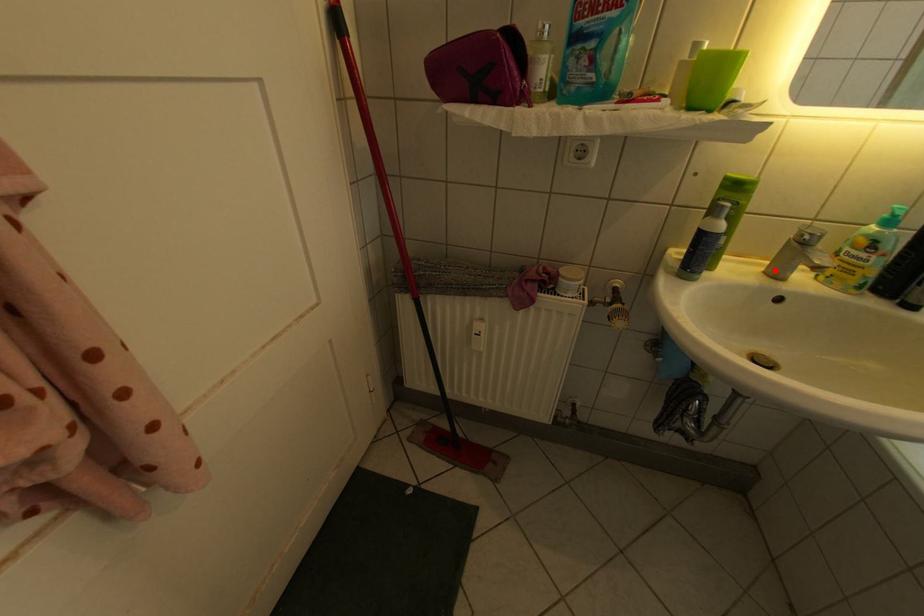
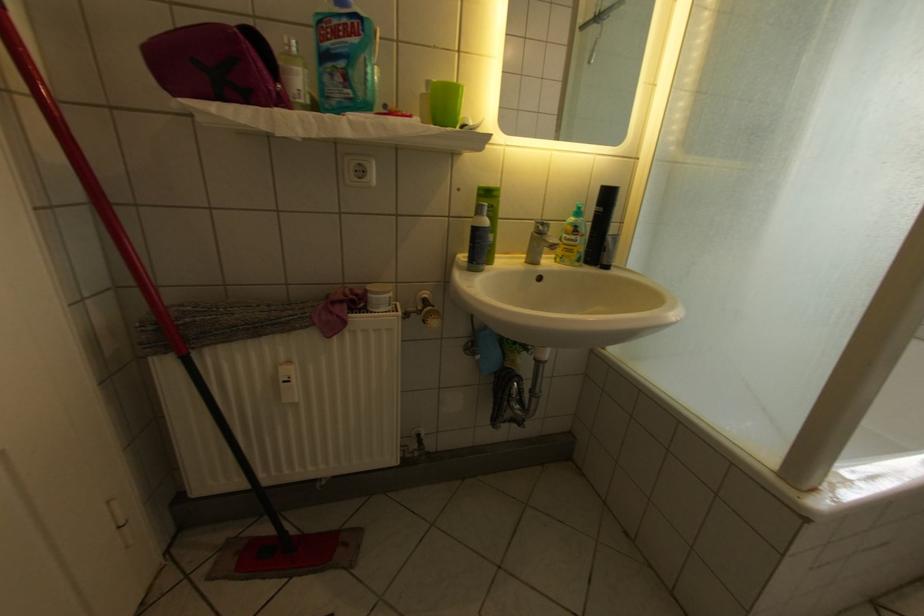
Where in the second image is the point corresponding to the highlighted location from the first image?

(536, 262)